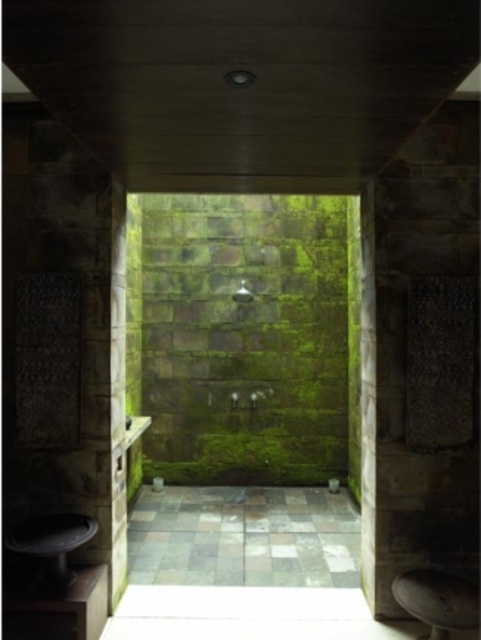
You are a maintenance worker needing to reach the recessed light fixture on the ceiling. You have a ladder that is 3 meters tall. The wooden stool at lower right and the matte green stone shower at center are in your way. Can you safely place the ladder near the shower to reach the light?

The wooden stool at lower right is 3.28 meters away from the matte green stone shower at center. Since the ladder is only 3 meters tall, the distance between the two objects is greater than the ladder height, so placing the ladder near the shower would leave enough space to safely reach the light fixture.

You are standing in the shower area and see the point at coordinates (438, 600). What object is located at this point?

The point at coordinates (438, 600) corresponds to the wooden stool at lower right.